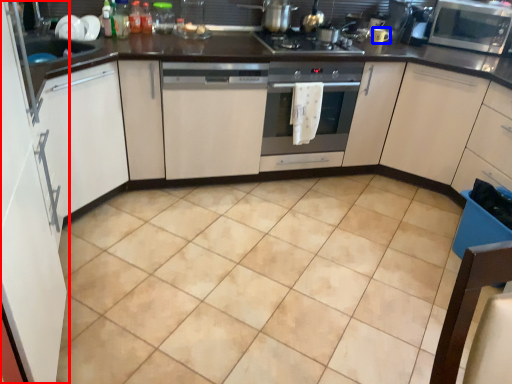
Question: Which point is further to the camera, cabinetry (highlighted by a red box) or appliance (highlighted by a blue box)?

Choices:
 (A) cabinetry
 (B) appliance

Answer: (B)